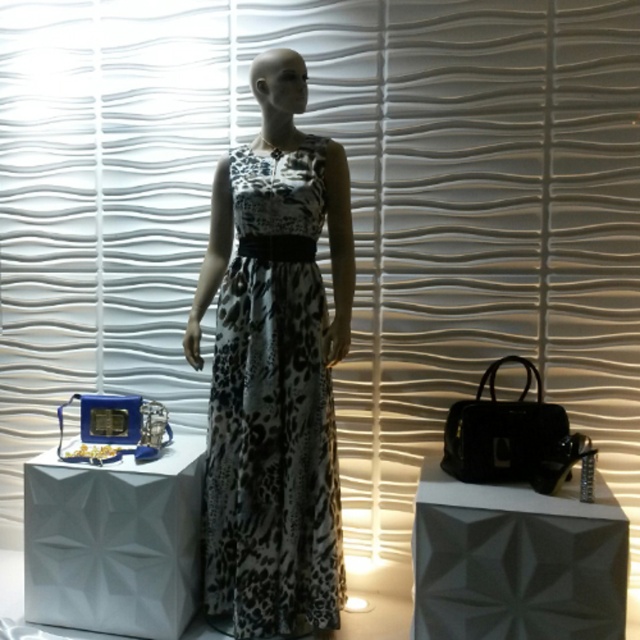
Measure the distance from black printed fabric dress at center to white matte box at lower left.

12.51 inches

This screenshot has height=640, width=640. What are the coordinates of `black printed fabric dress at center` in the screenshot? It's located at (273, 408).